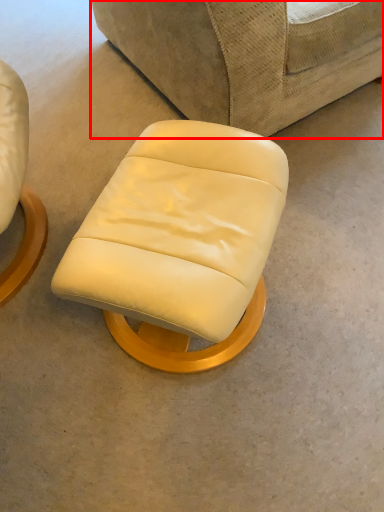
Question: Considering the relative positions of studio couch (annotated by the red box) and chair in the image provided, where is studio couch (annotated by the red box) located with respect to the staircase?

Choices:
 (A) right
 (B) left

Answer: (A)